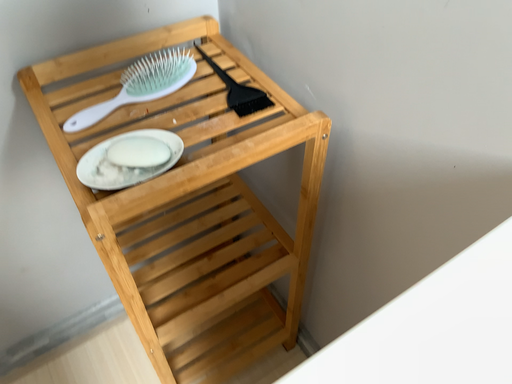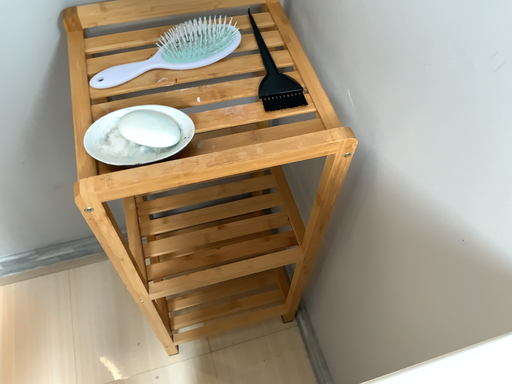
Question: Which way did the camera rotate in the video?

Choices:
 (A) rotated downward
 (B) rotated upward

Answer: (A)